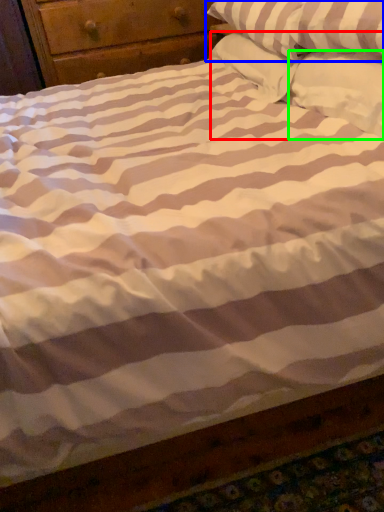
Question: Which object is positioned farthest from pillow (highlighted by a red box)? Select from pillow (highlighted by a blue box) and pillow (highlighted by a green box).

Choices:
 (A) pillow
 (B) pillow

Answer: (A)